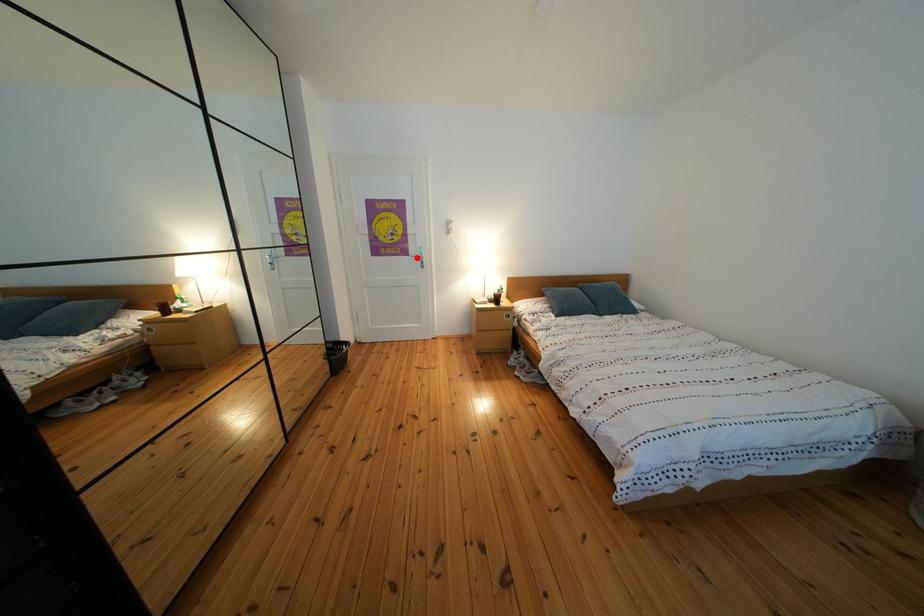
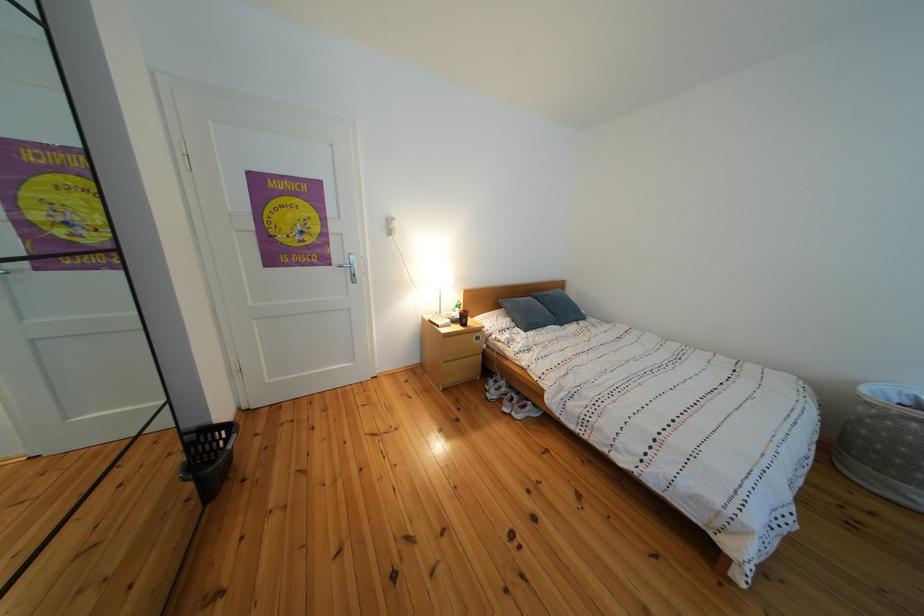
Find the pixel in the second image that matches the highlighted location in the first image.

(337, 267)